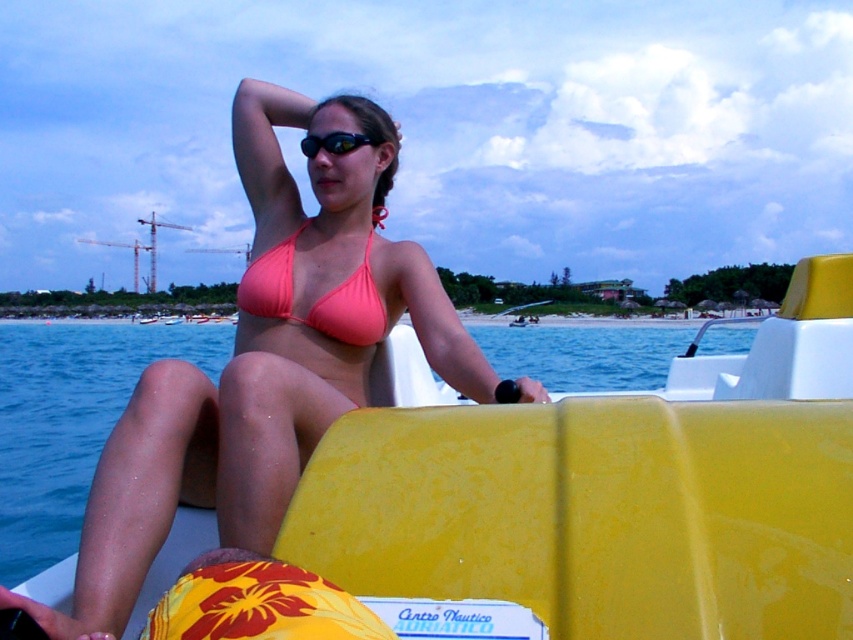
Does yellow plastic boat at center have a greater height compared to pink matte bikini top at center?

Indeed, yellow plastic boat at center has a greater height compared to pink matte bikini top at center.

Between point (315, 568) and point (268, 269), which one is positioned in front?

Point (315, 568)

You are a GUI agent. You are given a task and a screenshot of the screen. Output one action in this format:
    pyautogui.click(x=<x>, y=<y>)
    Task: Click on the yellow plastic boat at center
    
    Given the screenshot: What is the action you would take?
    pyautogui.click(x=610, y=490)

Can you confirm if pink matte bikini at center is shorter than black rubber goggles at upper center?

No.

Is pink matte bikini at center thinner than black rubber goggles at upper center?

Yes.

Who is more forward, (x=271, y=481) or (x=360, y=132)?

Point (x=271, y=481) is in front.

In order to click on pink matte bikini at center in this screenshot , I will do `click(265, 358)`.

Is yellow plastic boat at center thinner than pink matte bikini at center?

No, yellow plastic boat at center is not thinner than pink matte bikini at center.

Where is `yellow plastic boat at center`? Image resolution: width=853 pixels, height=640 pixels. yellow plastic boat at center is located at coordinates (x=610, y=490).

The image size is (853, 640). Find the location of `yellow plastic boat at center`. yellow plastic boat at center is located at coordinates (610, 490).